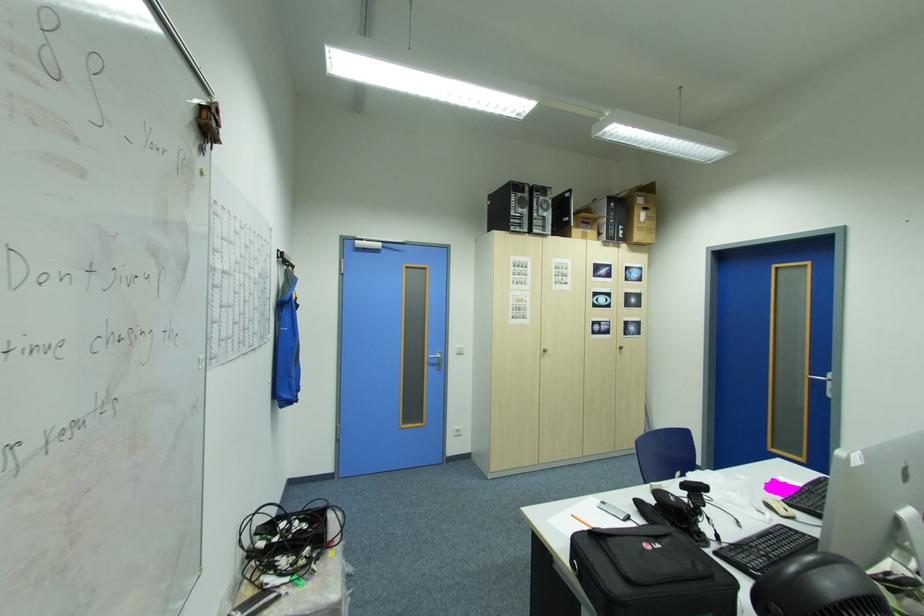
Where would you lift the cardboard box? Please return your answer as a coordinate pair (x, y).

(641, 211)